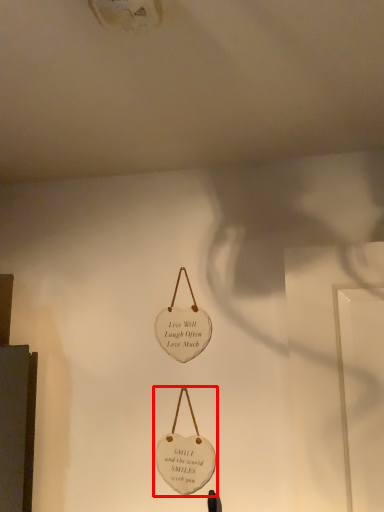
Question: From the image, what is the correct spatial relationship of handbag (annotated by the red box) in relation to handbag?

Choices:
 (A) left
 (B) right

Answer: (B)